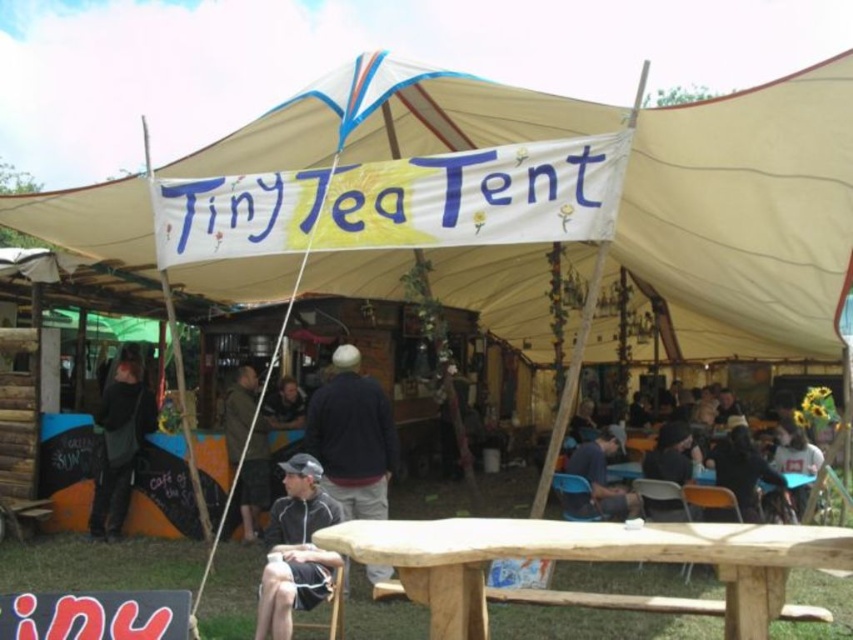
Who is lower down, natural wood table at center or dark blue shirt at center?

natural wood table at center

Does natural wood table at center lie behind dark blue shirt at center?

No, natural wood table at center is in front of dark blue shirt at center.

Between point (688, 605) and point (572, 467), which one is positioned behind?

The point (572, 467) is more distant.

Identify the location of natural wood table at center. This screenshot has width=853, height=640. (590, 561).

Which is above, dark gray hoodie at left or dark blue jacket at center?

dark blue jacket at center is higher up.

Does dark gray hoodie at left appear on the left side of dark blue jacket at center?

Indeed, dark gray hoodie at left is positioned on the left side of dark blue jacket at center.

Who is more distant from viewer, [99,481] or [254,470]?

Positioned behind is point [99,481].

Identify the location of dark gray hoodie at left. The width and height of the screenshot is (853, 640). (119, 445).

Is the position of beige canvas canopy at center less distant than that of natural wood table at center?

No, it is not.

This screenshot has height=640, width=853. Find the location of `beige canvas canopy at center`. beige canvas canopy at center is located at coordinates (746, 212).

Locate an element on the screen. beige canvas canopy at center is located at coordinates (746, 212).